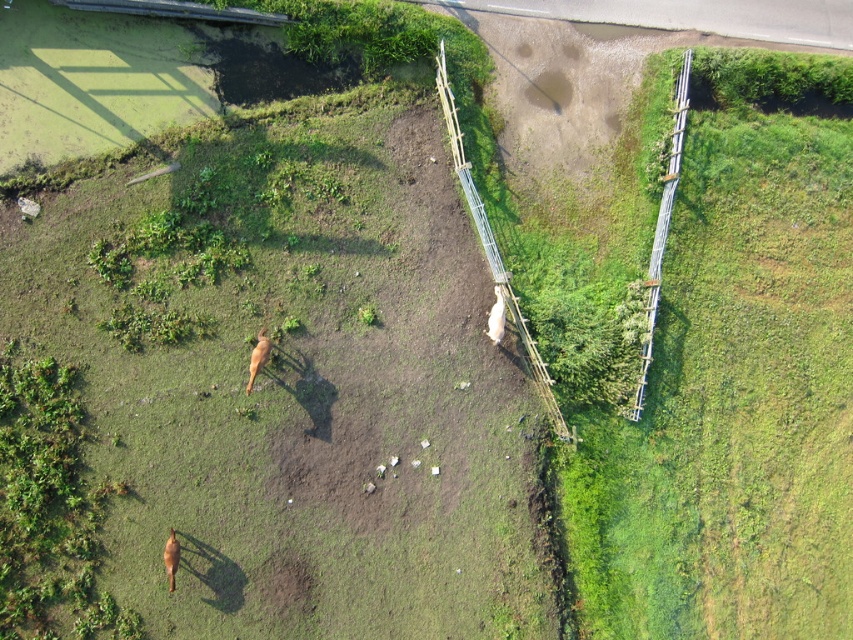
Question: Which point is farther from the camera taking this photo?

Choices:
 (A) (532, 349)
 (B) (663, 292)

Answer: (B)

Question: Is wooden fence at right smaller than brown furry dog at lower left?

Choices:
 (A) yes
 (B) no

Answer: (B)

Question: Which point is farther from the camera taking this photo?

Choices:
 (A) (496, 292)
 (B) (170, 554)

Answer: (A)

Question: Which of the following is the closest to the observer?

Choices:
 (A) wooden fence at right
 (B) green grassy at right
 (C) brown furry dog at center

Answer: (C)

Question: Observing the image, what is the correct spatial positioning of green grassy at right in reference to wooden planks at center?

Choices:
 (A) right
 (B) left

Answer: (A)

Question: Is wooden planks at center below white fluffy dog at center?

Choices:
 (A) no
 (B) yes

Answer: (A)